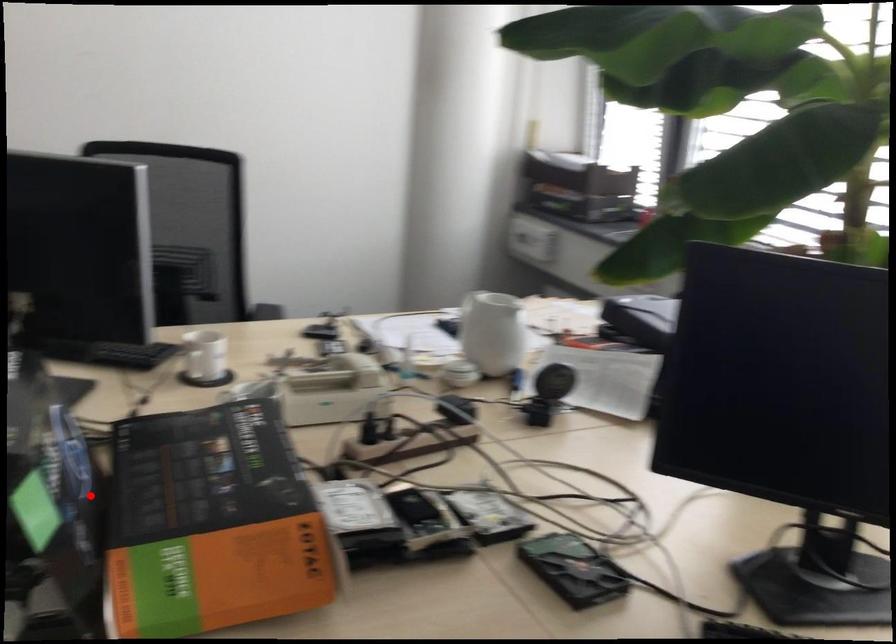
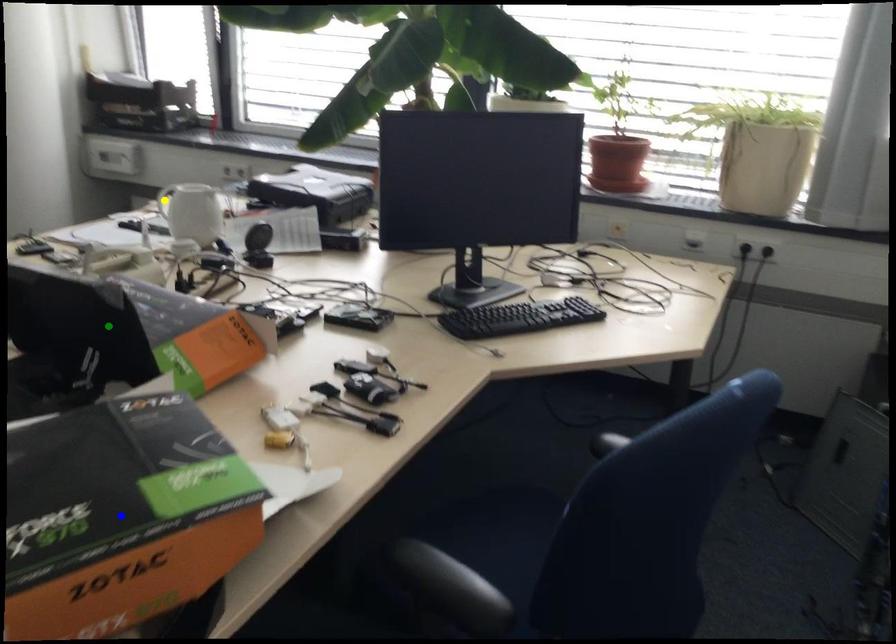
Question: I am providing you with two images of the same scene from different viewpoints. A red point is marked on the first image. You are given multiple points on the second image. In image 2, which mark is for the same physical point as the one in image 1?

Choices:
 (A) blue point
 (B) green point
 (C) yellow point

Answer: (B)